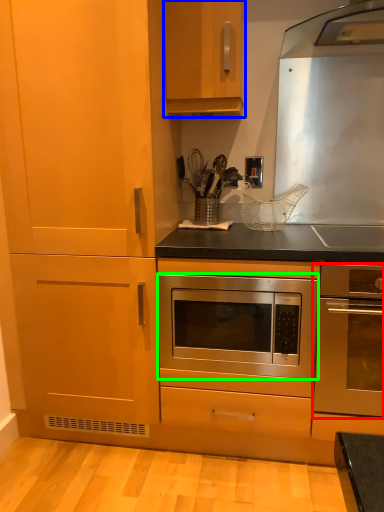
Question: Considering the real-world distances, which object is farthest from oven (highlighted by a red box)? cabinetry (highlighted by a blue box) or oven (highlighted by a green box)?

Choices:
 (A) cabinetry
 (B) oven

Answer: (A)